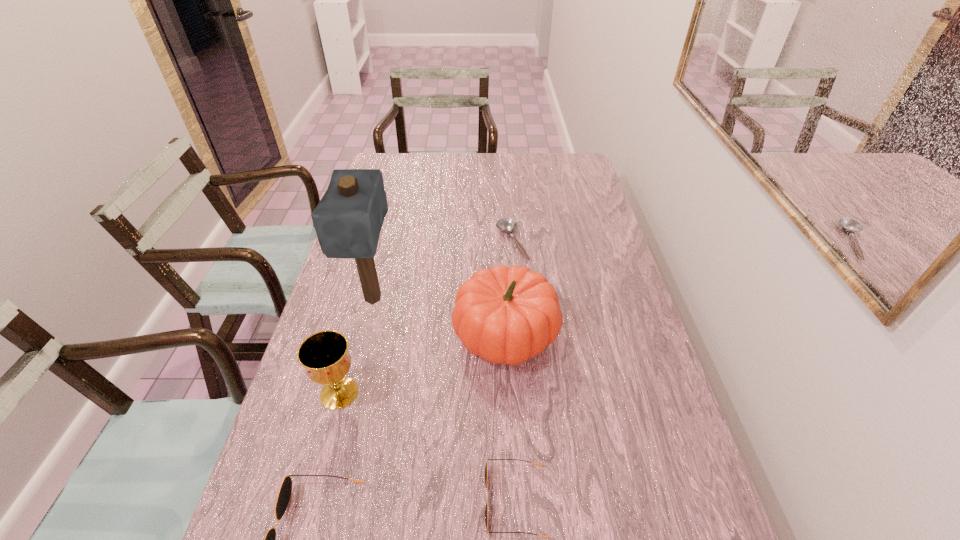
Where is `the shorter sunglasses`? The width and height of the screenshot is (960, 540). the shorter sunglasses is located at coordinates (486, 470).

You are a GUI agent. You are given a task and a screenshot of the screen. Output one action in this format:
    pyautogui.click(x=<x>, y=<y>)
    Task: Click on the fifth tallest object
    The image size is (960, 540).
    Given the screenshot: What is the action you would take?
    pyautogui.click(x=486, y=470)

Find the location of a particular element. Image resolution: width=960 pixels, height=540 pixels. mallet is located at coordinates (348, 219).

Identify the location of ladle. (508, 225).

The width and height of the screenshot is (960, 540). I want to click on the farthest object, so click(x=508, y=225).

The width and height of the screenshot is (960, 540). I want to click on pumpkin, so click(506, 315).

Where is `chalice`? The image size is (960, 540). chalice is located at coordinates (324, 355).

At what (x,y) coordinates should I click in order to perform the action: click on vacant space situated on the front-facing side of the shorter sunglasses. Please return your answer as a coordinate pair (x, y). Looking at the image, I should click on (325, 501).

Identify the location of vacant area located 0.250m on the front-facing side of the shorter sunglasses. (360, 501).

Find the location of a particular element. The width and height of the screenshot is (960, 540). blank space located on the front-facing side of the shorter sunglasses is located at coordinates (405, 501).